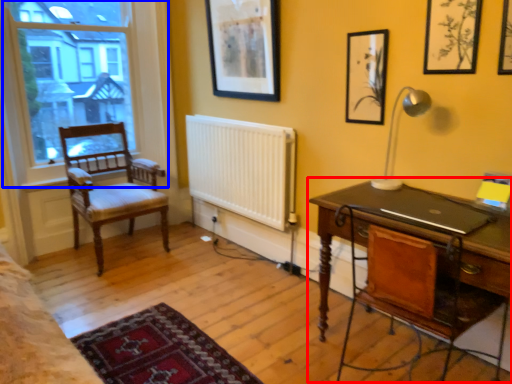
Question: Which of the following is the farthest to the observer, desk (highlighted by a red box) or window (highlighted by a blue box)?

Choices:
 (A) desk
 (B) window

Answer: (B)